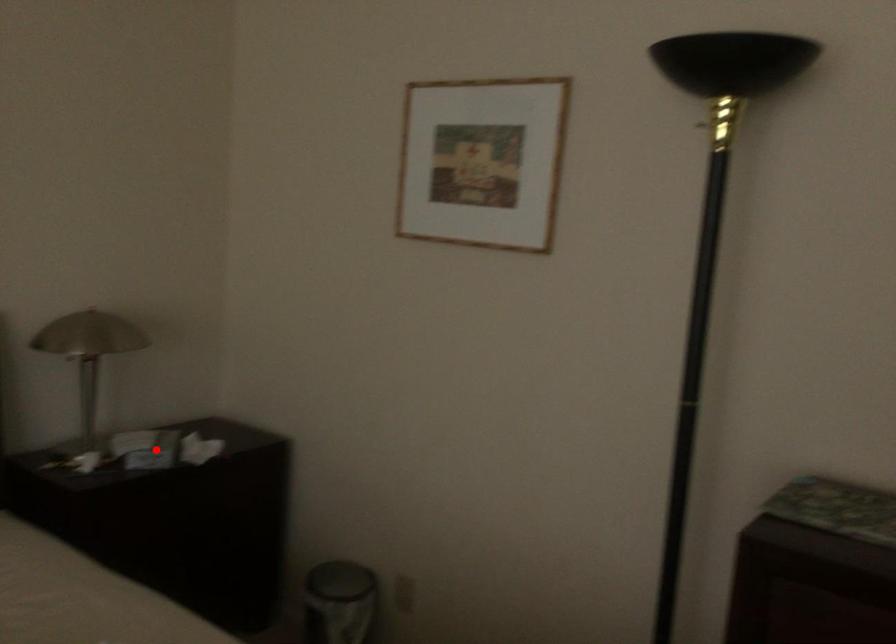
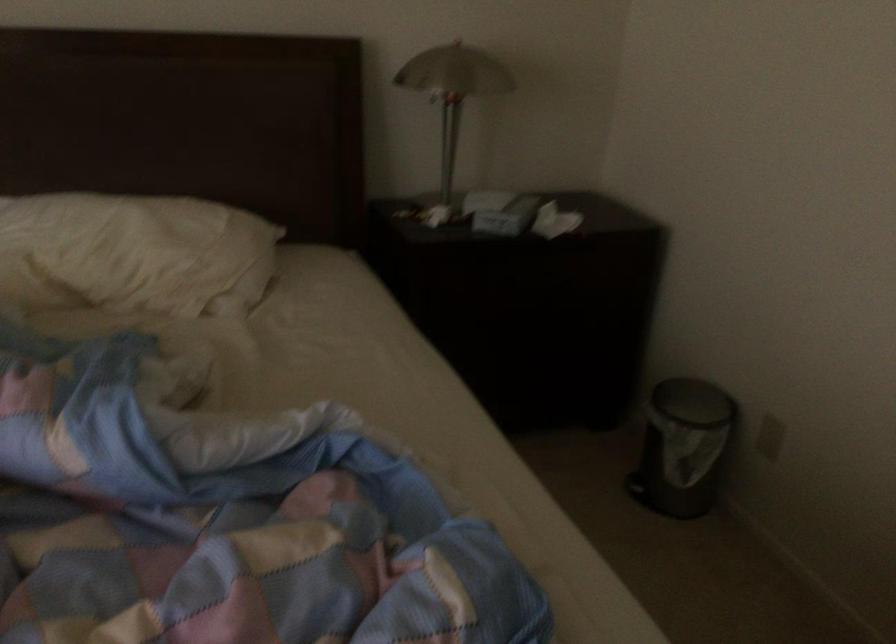
The point at the highlighted location is marked in the first image. Where is the corresponding point in the second image?

(501, 212)